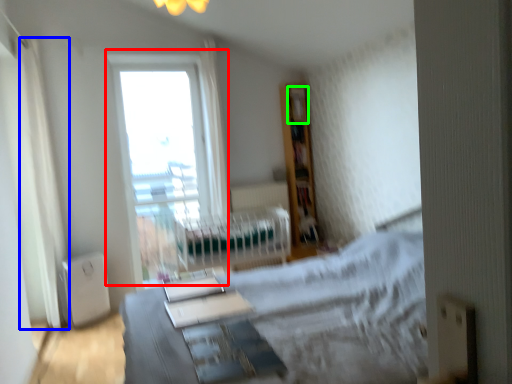
Question: Which object is positioned closest to window (highlighted by a red box)? Select from curtain (highlighted by a blue box) and shelf (highlighted by a green box).

Choices:
 (A) curtain
 (B) shelf

Answer: (A)